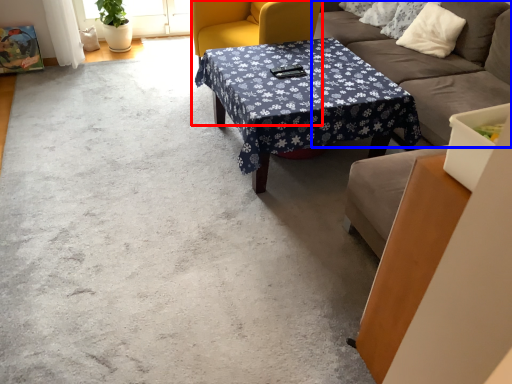
Question: Which object appears farthest to the camera in this image, swivel chair (highlighted by a red box) or studio couch (highlighted by a blue box)?

Choices:
 (A) swivel chair
 (B) studio couch

Answer: (A)